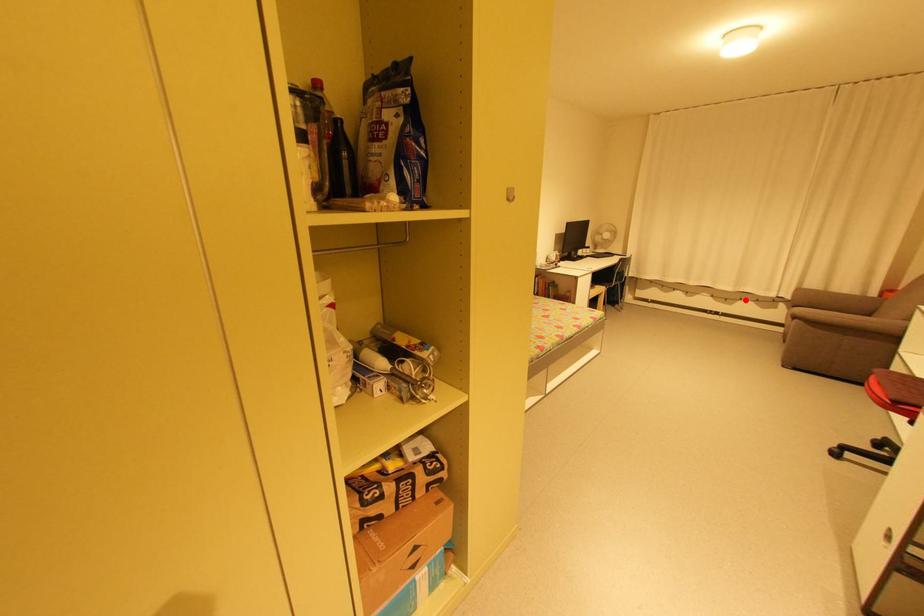
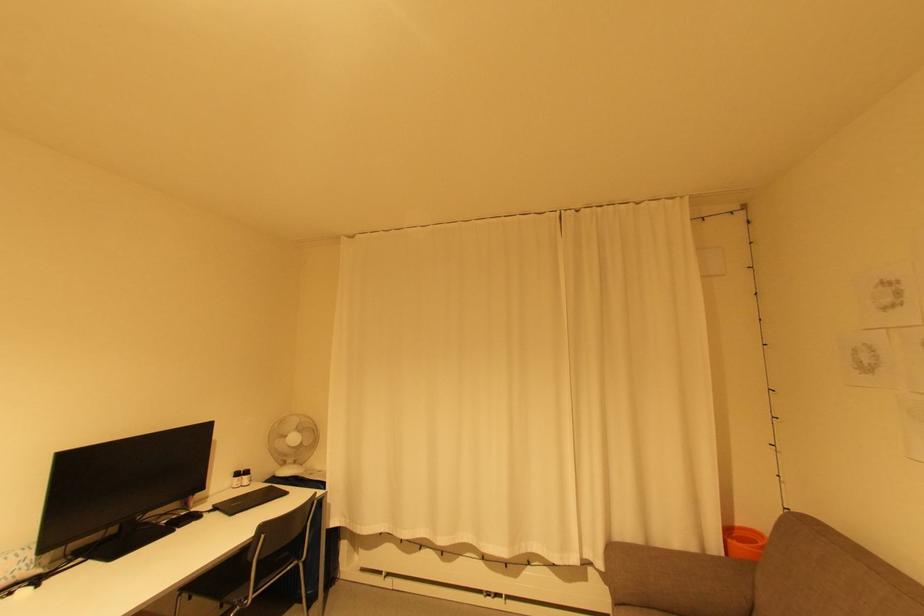
Question: I am providing you with two images of the same scene from different viewpoints. In image1, a red point is highlighted. Considering the same 3D point in image2, which of the following is correct?

Choices:
 (A) It is closer
 (B) It is farther

Answer: (B)